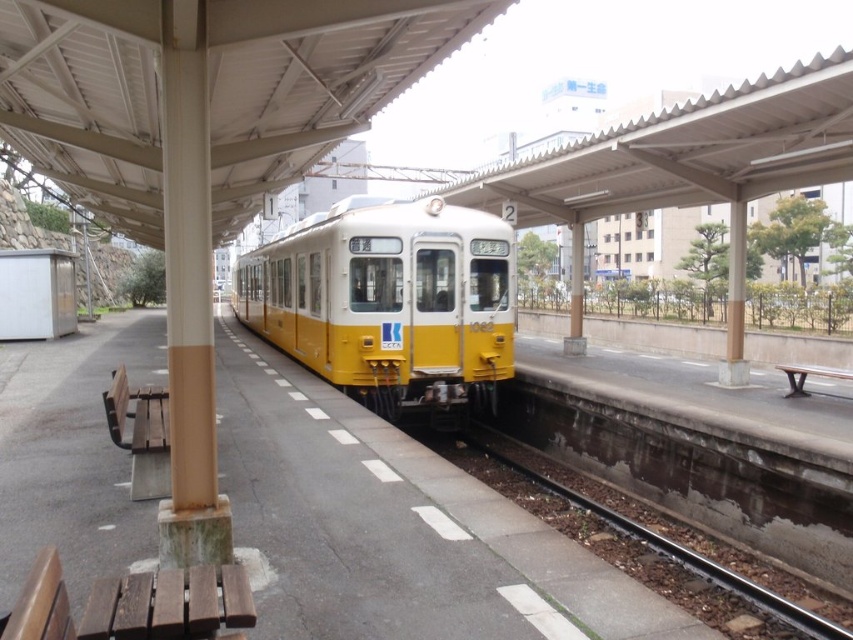
Is point (485, 332) farther from viewer compared to point (676, 524)?

Yes.

Can you confirm if yellow matte train at center is positioned above brown gravel at lower center?

Yes.

Between point (317, 272) and point (733, 563), which one is positioned in front?

Point (733, 563)

Find the location of a particular element. The width and height of the screenshot is (853, 640). yellow matte train at center is located at coordinates (389, 300).